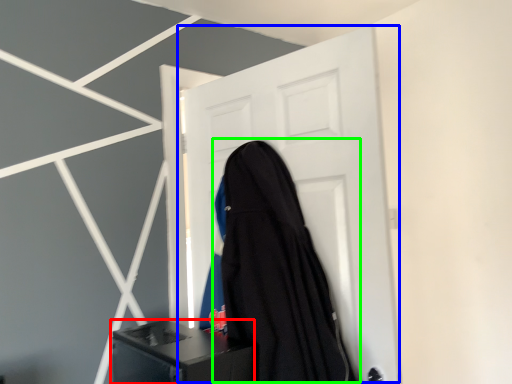
Question: Based on their relative distances, which object is nearer to furniture (highlighted by a red box)? Choose from door (highlighted by a blue box) and garment (highlighted by a green box).

Choices:
 (A) door
 (B) garment

Answer: (B)